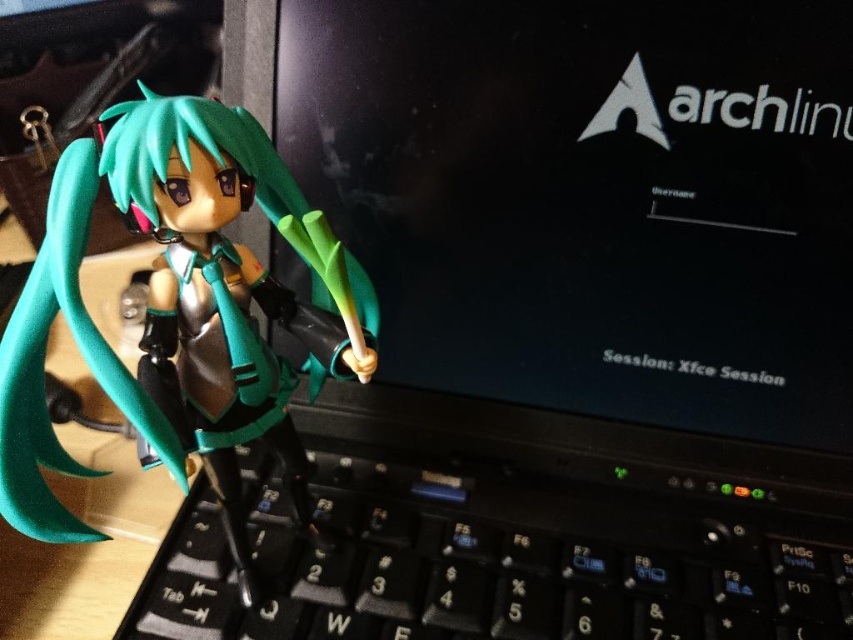
Does black plastic keyboard at center have a greater height compared to semi-glossy green figure at left?

Incorrect, black plastic keyboard at center's height is not larger of semi-glossy green figure at left's.

This screenshot has height=640, width=853. In order to click on black plastic keyboard at center in this screenshot , I will do `click(496, 563)`.